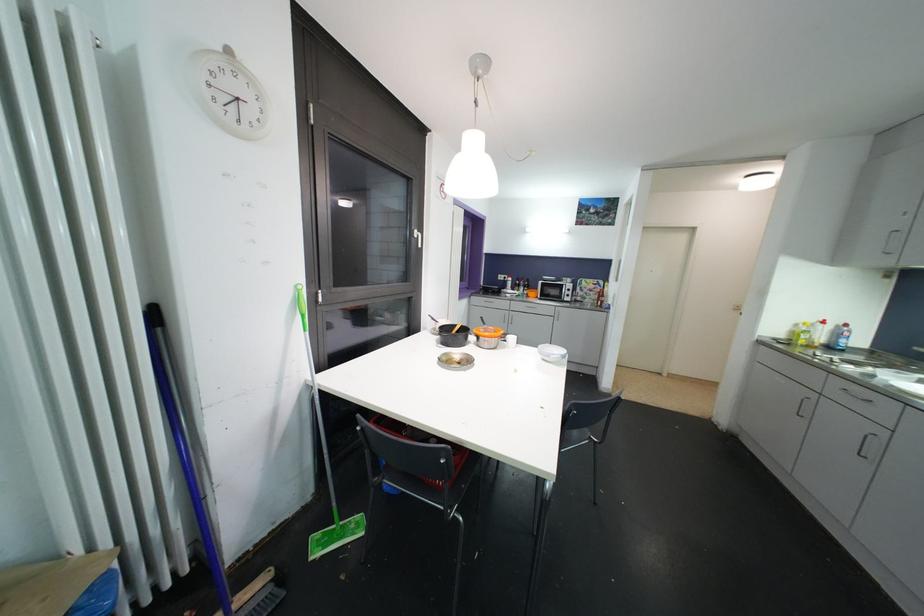
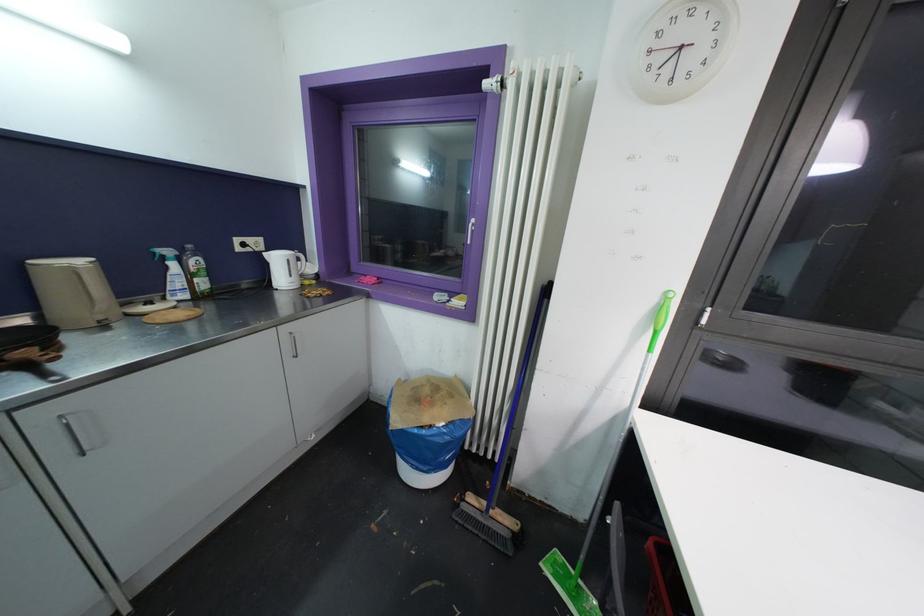
Question: The images are taken continuously from a first-person perspective. In which direction is your viewpoint rotating?

Choices:
 (A) Left
 (B) Right
 (C) Up
 (D) Down

Answer: (A)